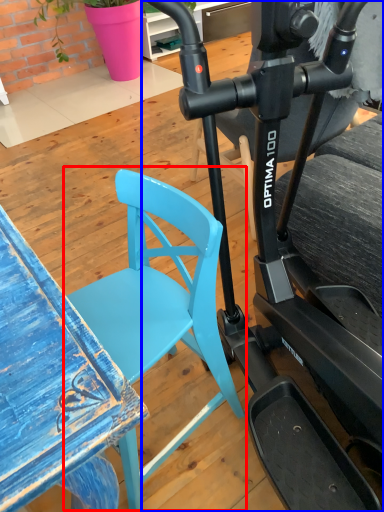
Question: Which of the following is the farthest to the observer, chair (highlighted by a red box) or stationary bicycle (highlighted by a blue box)?

Choices:
 (A) chair
 (B) stationary bicycle

Answer: (A)